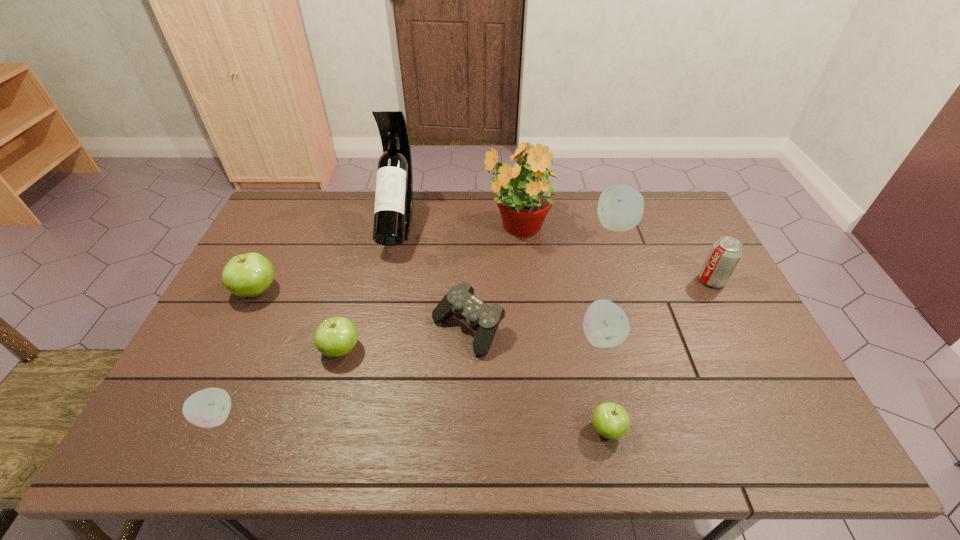
At what (x,y) coordinates should I click in order to perform the action: click on vacant area that lies between the flowerpot and the wine bottle. Please return your answer as a coordinate pair (x, y). The image size is (960, 540). Looking at the image, I should click on (457, 225).

At what (x,y) coordinates should I click in order to perform the action: click on blank region between the second green apple from right to left and the control. Please return your answer as a coordinate pair (x, y). Image resolution: width=960 pixels, height=540 pixels. Looking at the image, I should click on (404, 339).

Identify the location of vacant space that is in between the biggest green apple and the control. (362, 310).

This screenshot has height=540, width=960. I want to click on vacant space that is in between the control and the leftmost white apple, so click(x=342, y=373).

At what (x,y) coordinates should I click in order to perform the action: click on blank region between the biggest green apple and the second white apple from right to left. Please return your answer as a coordinate pair (x, y). This screenshot has width=960, height=540. Looking at the image, I should click on (429, 314).

Find the location of `free space between the nearest white apple and the ninth object from left to right`. free space between the nearest white apple and the ninth object from left to right is located at coordinates (416, 321).

Where is `vacant region between the fifth nearest apple and the control`? This screenshot has width=960, height=540. vacant region between the fifth nearest apple and the control is located at coordinates (362, 310).

In order to click on object that ranks as the fourth closest to the flowerpot in this screenshot , I will do `click(605, 325)`.

Locate which object is the fourth closest to the second object from right to left. Please provide its 2D coordinates. Your answer should be formatted as a tuple, i.e. [(x, y)], where the tuple contains the x and y coordinates of a point satisfying the conditions above.

[(460, 301)]

The height and width of the screenshot is (540, 960). I want to click on the third closest apple to the gray soda can, so click(x=611, y=420).